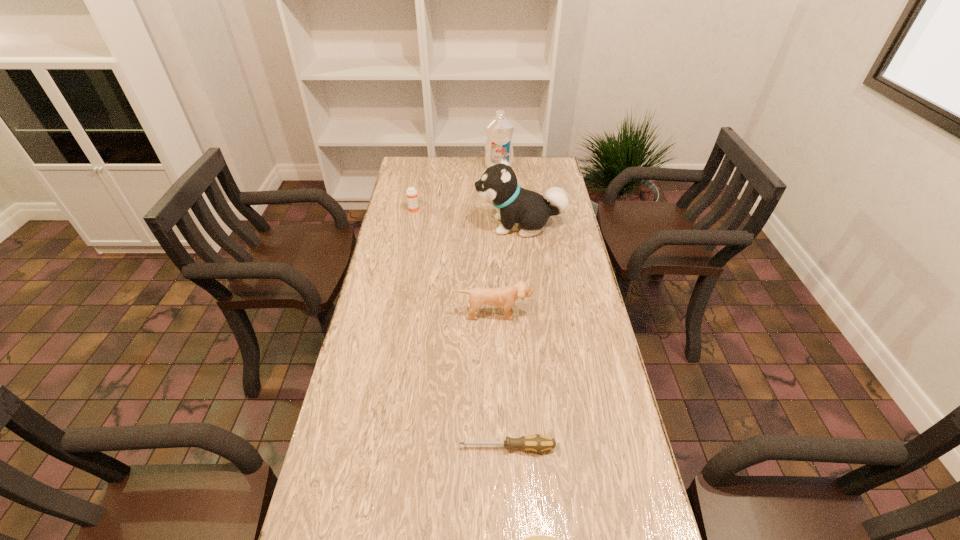
This screenshot has width=960, height=540. In order to click on vacant area at the left edge in this screenshot , I will do `click(416, 294)`.

Where is `vacant space at the right edge of the desktop`? The width and height of the screenshot is (960, 540). vacant space at the right edge of the desktop is located at coordinates (573, 353).

In the image, there is a desktop. Identify the location of blank space at the far left corner. This screenshot has height=540, width=960. (412, 159).

What are the coordinates of `vacant area at the far right corner` in the screenshot? It's located at (533, 167).

The height and width of the screenshot is (540, 960). In order to click on free space between the shortest object and the taller puppy in this screenshot , I will do `click(514, 336)`.

Where is `vacant space in between the leftmost object and the taller puppy`? vacant space in between the leftmost object and the taller puppy is located at coordinates (468, 218).

Locate an element on the screen. This screenshot has width=960, height=540. free point between the farther puppy and the leftmost object is located at coordinates (468, 218).

Where is `free space between the second nearest object and the taller puppy`? This screenshot has width=960, height=540. free space between the second nearest object and the taller puppy is located at coordinates (514, 336).

You are a GUI agent. You are given a task and a screenshot of the screen. Output one action in this format:
    pyautogui.click(x=<x>, y=<y>)
    Task: Click on the empty location between the farthest object and the leftmost object
    Image resolution: width=960 pixels, height=540 pixels.
    Given the screenshot: What is the action you would take?
    pyautogui.click(x=457, y=188)

Locate an element on the screen. The width and height of the screenshot is (960, 540). object that is the fourth closest to the leftmost object is located at coordinates (538, 443).